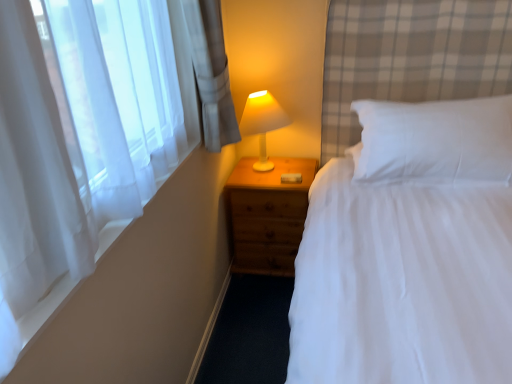
Question: Is white plastic lamp at upper right bigger than sheer white curtain at left?

Choices:
 (A) no
 (B) yes

Answer: (B)

Question: Is white plastic lamp at upper right positioned with its back to sheer white curtain at left?

Choices:
 (A) no
 (B) yes

Answer: (A)

Question: Is white plastic lamp at upper right beside sheer white curtain at left?

Choices:
 (A) no
 (B) yes

Answer: (A)

Question: Does white plastic lamp at upper right appear on the left side of sheer white curtain at left?

Choices:
 (A) yes
 (B) no

Answer: (B)

Question: From a real-world perspective, is white plastic lamp at upper right positioned over sheer white curtain at left based on gravity?

Choices:
 (A) yes
 (B) no

Answer: (B)

Question: Considering the positions of white plastic lamp at upper right and white soft pillow at upper right in the image, is white plastic lamp at upper right bigger or smaller than white soft pillow at upper right?

Choices:
 (A) small
 (B) big

Answer: (A)

Question: Is white plastic lamp at upper right taller or shorter than white soft pillow at upper right?

Choices:
 (A) short
 (B) tall

Answer: (B)

Question: Considering the relative positions of white plastic lamp at upper right and white soft pillow at upper right in the image provided, is white plastic lamp at upper right to the left or to the right of white soft pillow at upper right?

Choices:
 (A) left
 (B) right

Answer: (A)

Question: From the image's perspective, is white plastic lamp at upper right positioned above or below white soft pillow at upper right?

Choices:
 (A) below
 (B) above

Answer: (B)

Question: From the image's perspective, relative to wooden nightstand at center, is sheer white curtain at left above or below?

Choices:
 (A) above
 (B) below

Answer: (A)

Question: Is sheer white curtain at left inside the boundaries of wooden nightstand at center, or outside?

Choices:
 (A) inside
 (B) outside

Answer: (B)

Question: Is sheer white curtain at left bigger or smaller than wooden nightstand at center?

Choices:
 (A) small
 (B) big

Answer: (A)

Question: Is sheer white curtain at left in front of or behind wooden nightstand at center in the image?

Choices:
 (A) behind
 (B) front

Answer: (B)

Question: In the image, is white soft pillow at upper right positioned in front of or behind wooden nightstand at center?

Choices:
 (A) behind
 (B) front

Answer: (B)

Question: In terms of height, does white soft pillow at upper right look taller or shorter compared to wooden nightstand at center?

Choices:
 (A) tall
 (B) short

Answer: (B)